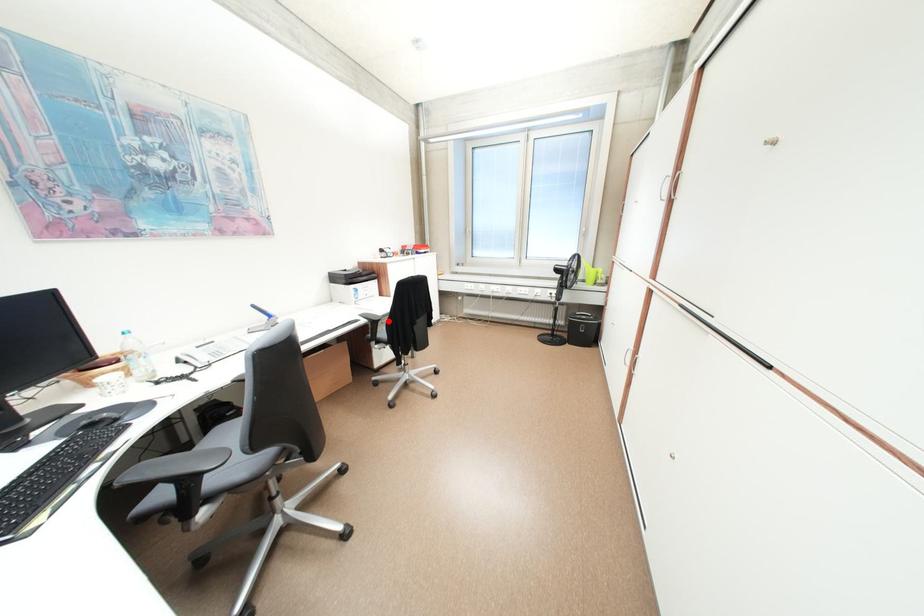
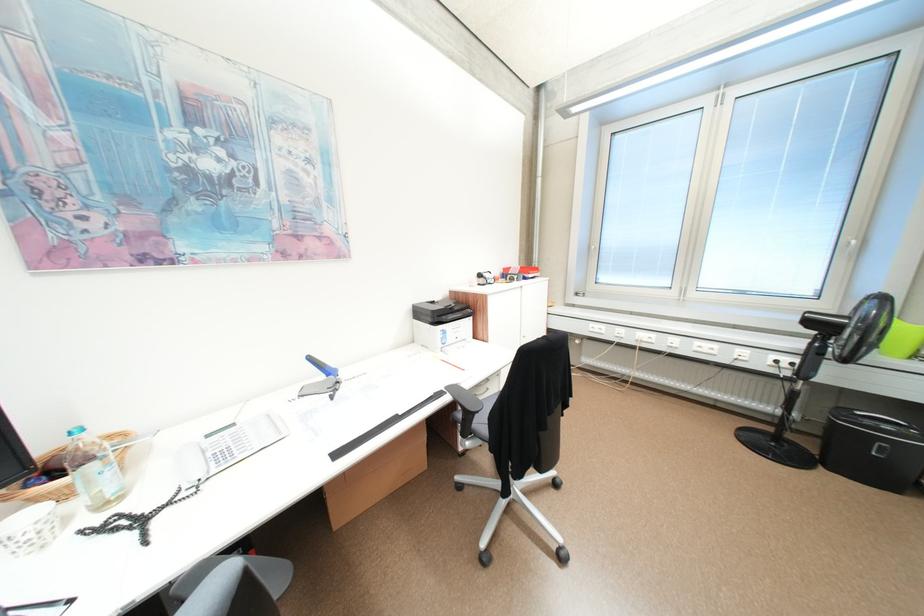
The point at the highlighted location is marked in the first image. Where is the corresponding point in the second image?

(487, 411)